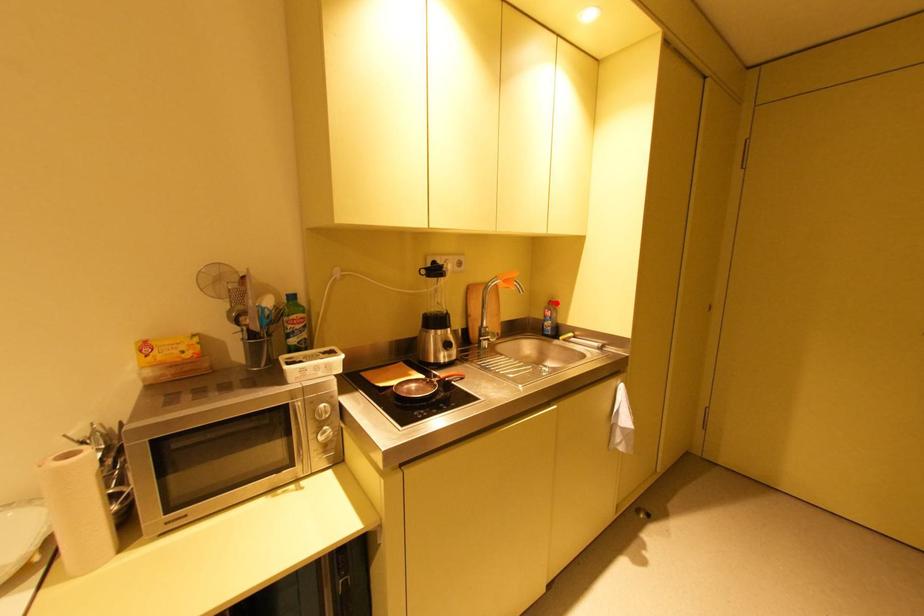
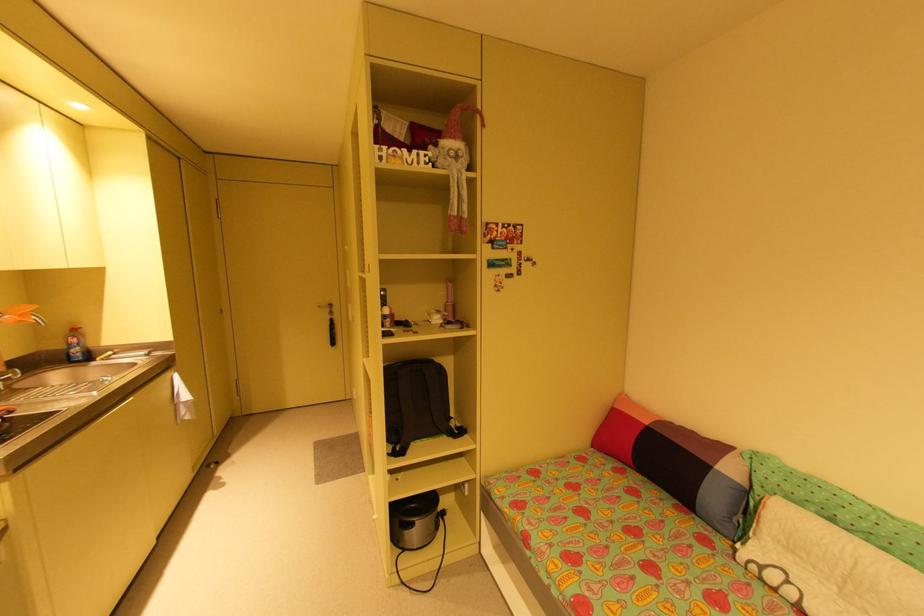
Locate, in the second image, the point that corresponds to the highlighted location in the first image.

(79, 331)